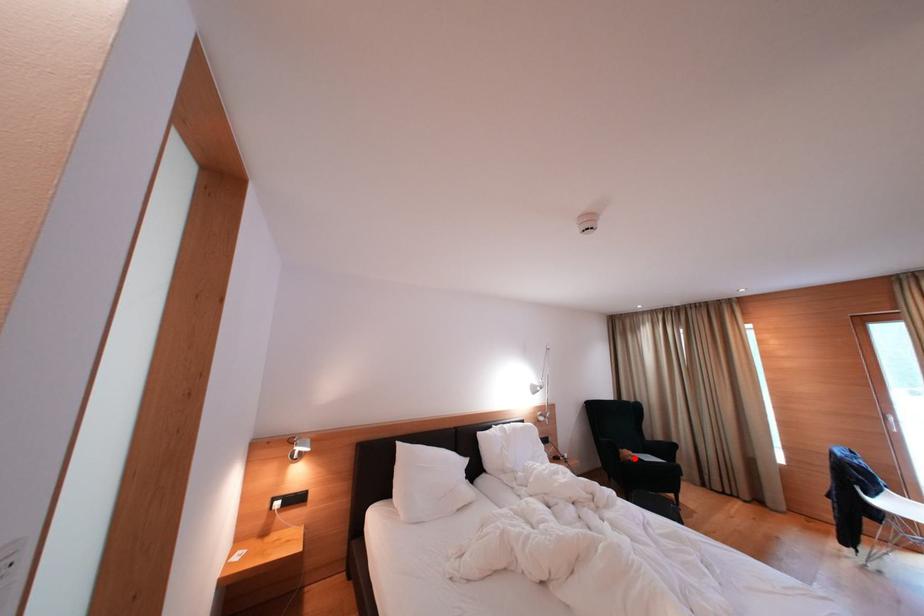
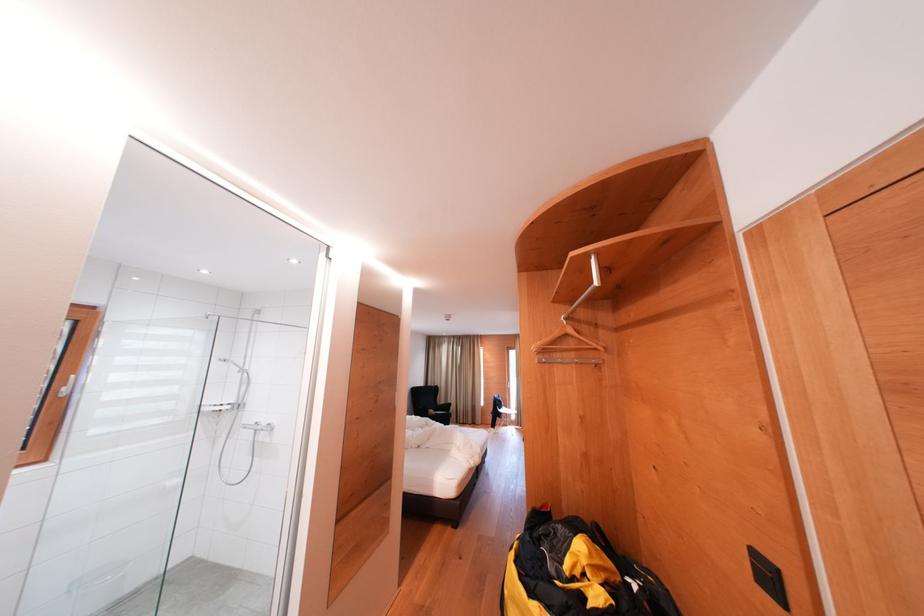
Question: I am providing you with two images of the same scene from different viewpoints. A red point is shown in image1. For the corresponding object point in image2, is it positioned nearer or farther from the camera?

Choices:
 (A) Nearer
 (B) Farther

Answer: (B)